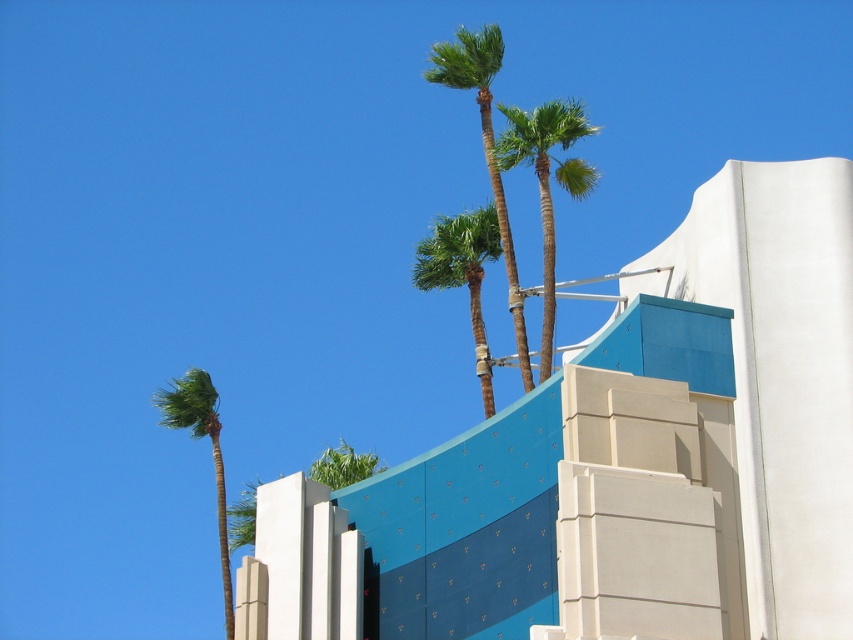
Question: Among these points, which one is nearest to the camera?

Choices:
 (A) click(643, 500)
 (B) click(219, 557)

Answer: (A)

Question: Is the position of green leafy palm trees at upper center more distant than that of green leafy palm tree at upper center?

Choices:
 (A) no
 (B) yes

Answer: (A)

Question: Which point appears farthest from the camera in this image?

Choices:
 (A) (473, 292)
 (B) (479, 90)
 (C) (552, 131)

Answer: (B)

Question: Is green leafy palm trees at upper center thinner than green leafy palm tree at upper center?

Choices:
 (A) no
 (B) yes

Answer: (B)

Question: Does green leafy palm tree at upper center lie behind green leafy palm tree at upper left?

Choices:
 (A) no
 (B) yes

Answer: (A)

Question: Which point is closer to the camera taking this photo?

Choices:
 (A) (515, 154)
 (B) (488, 163)

Answer: (A)